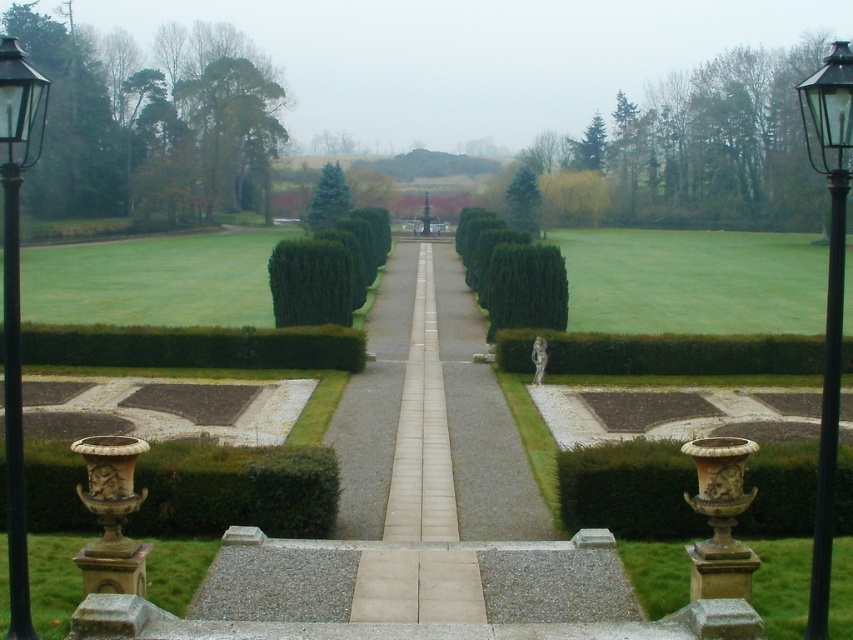
You are a gardener who needs to water the green matte hedge at center using a hose that can only reach 20 meters. You are currently standing next to the black metal street light at right. Can you water the hedge without moving the hose? Please explain your reasoning.

The black metal street light at right and green matte hedge at center are 23.60 meters apart. Since the hose can only reach 20 meters, the distance is too great. You cannot water the hedge without moving the hose closer.

You are designing a garden layout and need to place a new decorative element between the brown stone vase at lower right and the green glossy hedge at center. Considering their widths, which object should you place closer to the narrower side to maintain balance?

The brown stone vase at lower right has a smaller width than the green glossy hedge at center, so placing the new decorative element closer to the brown stone vase at lower right would help maintain balance between the two objects.